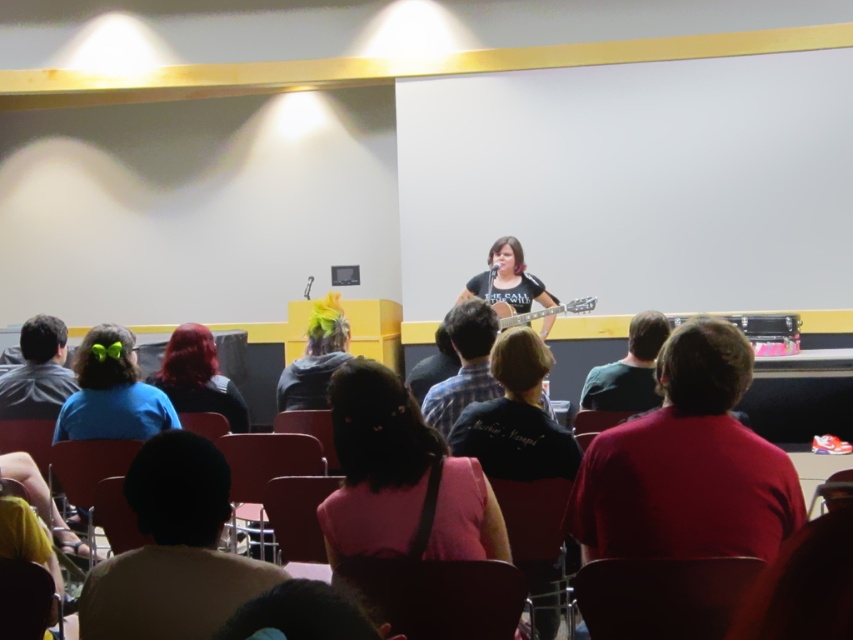
Question: Which point is farther to the camera?

Choices:
 (A) gray hoodie at left
 (B) pink fabric shirt at lower left
 (C) neon yellow hair at center

Answer: (C)

Question: Which point is closer to the camera taking this photo?

Choices:
 (A) (438, 346)
 (B) (280, 401)

Answer: (A)

Question: Which object is closer to the camera taking this photo?

Choices:
 (A) green matte shirt at center
 (B) plaid fabric shirt at center

Answer: (B)

Question: Can you confirm if pink fabric shirt at lower left is positioned above acoustic wood guitar at center?

Choices:
 (A) no
 (B) yes

Answer: (A)

Question: Is the position of blue matte shirt at lower left more distant than that of acoustic wood guitar at center?

Choices:
 (A) yes
 (B) no

Answer: (B)

Question: Can you confirm if blue matte shirt at lower left is positioned below acoustic wood guitar at center?

Choices:
 (A) yes
 (B) no

Answer: (A)